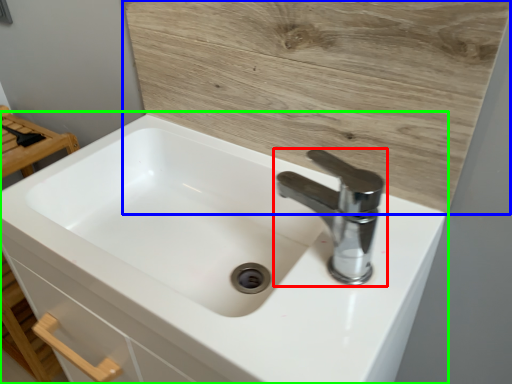
Question: Estimate the real-world distances between objects in this image. Which object is farther from tap (highlighted by a red box), plywood (highlighted by a blue box) or sink (highlighted by a green box)?

Choices:
 (A) plywood
 (B) sink

Answer: (B)